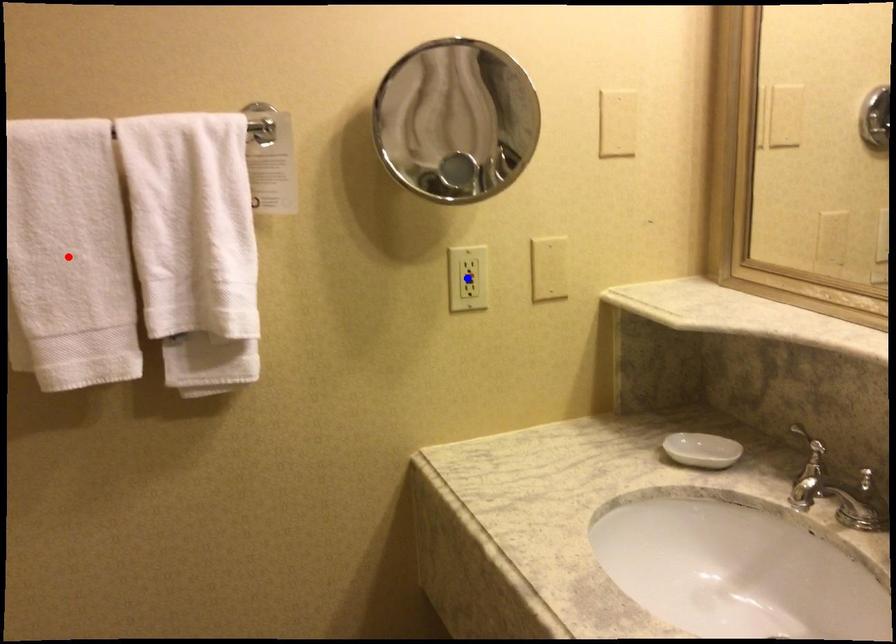
Question: In the image, two points are highlighted. Which point is nearer to the camera? Reply with the corresponding letter.

Choices:
 (A) blue point
 (B) red point

Answer: (B)